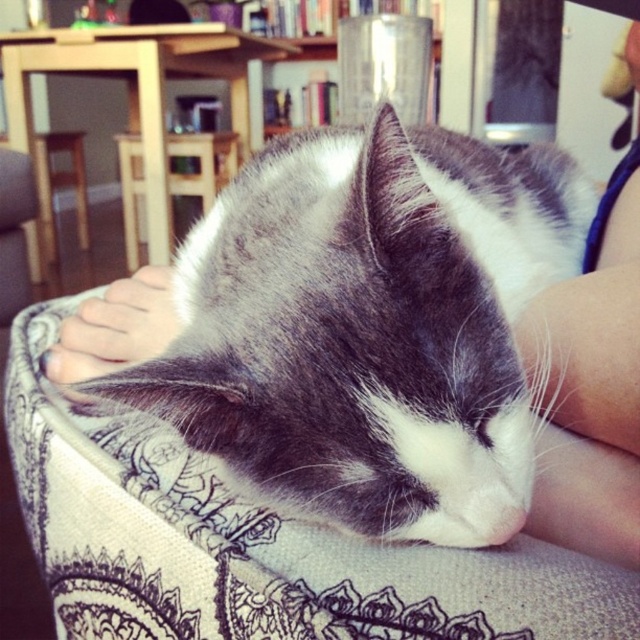
You are trying to locate the patterned fabric couch at center in the image. According to the coordinates provided, where would you find it?

The patterned fabric couch at center is located at point coordinates of (252, 545).